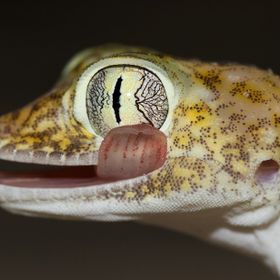
Image resolution: width=280 pixels, height=280 pixels. What are the coordinates of `scales` in the screenshot? It's located at (227, 168), (236, 129), (212, 118), (241, 79), (40, 125).